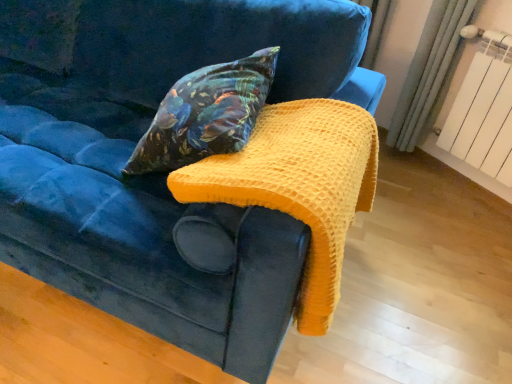
Question: Should I look upward or downward to see yellow waffle knit blanket at upper center?

Choices:
 (A) up
 (B) down

Answer: (A)

Question: Is the depth of white painted metal radiator at upper right less than that of yellow waffle knit blanket at upper center?

Choices:
 (A) yes
 (B) no

Answer: (B)

Question: Can you confirm if white painted metal radiator at upper right is taller than yellow waffle knit blanket at upper center?

Choices:
 (A) no
 (B) yes

Answer: (B)

Question: Is white painted metal radiator at upper right oriented away from yellow waffle knit blanket at upper center?

Choices:
 (A) yes
 (B) no

Answer: (B)

Question: Are white painted metal radiator at upper right and yellow waffle knit blanket at upper center making contact?

Choices:
 (A) yes
 (B) no

Answer: (B)

Question: From a real-world perspective, is white painted metal radiator at upper right physically above yellow waffle knit blanket at upper center?

Choices:
 (A) yes
 (B) no

Answer: (B)

Question: From a real-world perspective, is white painted metal radiator at upper right located beneath yellow waffle knit blanket at upper center?

Choices:
 (A) yes
 (B) no

Answer: (A)

Question: Is white painted metal radiator at upper right further to the viewer compared to velvet floral pillow at center?

Choices:
 (A) no
 (B) yes

Answer: (B)

Question: Are white painted metal radiator at upper right and velvet floral pillow at center making contact?

Choices:
 (A) no
 (B) yes

Answer: (A)

Question: Is white painted metal radiator at upper right positioned with its back to velvet floral pillow at center?

Choices:
 (A) yes
 (B) no

Answer: (B)

Question: Is white painted metal radiator at upper right to the right of velvet floral pillow at center from the viewer's perspective?

Choices:
 (A) yes
 (B) no

Answer: (A)

Question: Is white painted metal radiator at upper right taller than velvet floral pillow at center?

Choices:
 (A) no
 (B) yes

Answer: (B)

Question: Is white painted metal radiator at upper right aimed at velvet floral pillow at center?

Choices:
 (A) no
 (B) yes

Answer: (B)

Question: Is velvet floral pillow at center in contact with yellow waffle knit blanket at upper center?

Choices:
 (A) yes
 (B) no

Answer: (B)